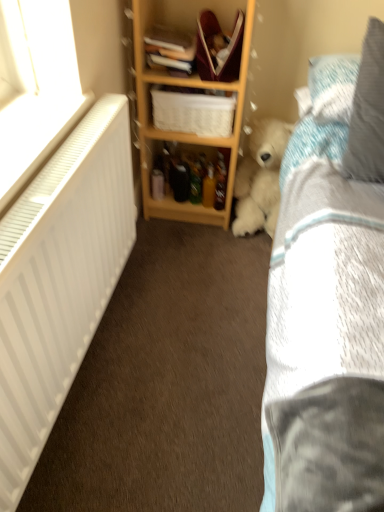
At what (x,y) coordinates should I click in order to perform the action: click on free space above white plastic radiator at left (from a real-world perspective). Please return your answer as a coordinate pair (x, y). Image resolution: width=384 pixels, height=512 pixels. Looking at the image, I should click on (26, 130).